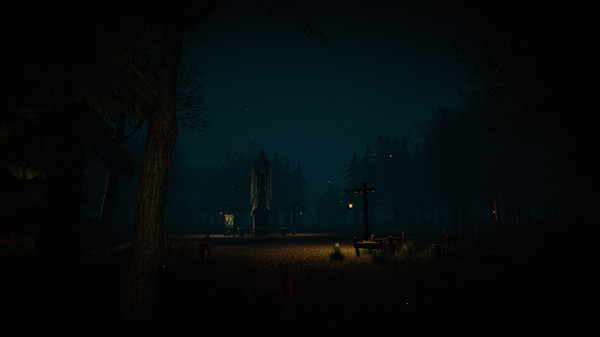
This screenshot has width=600, height=337. I want to click on statue, so click(258, 178).